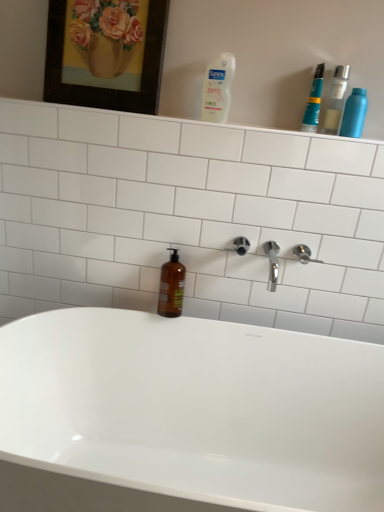
Image resolution: width=384 pixels, height=512 pixels. What are the coordinates of `free location to the right of white plastic bottle at upper center, which is the second cleaning product in right-to-left order` in the screenshot? It's located at (263, 125).